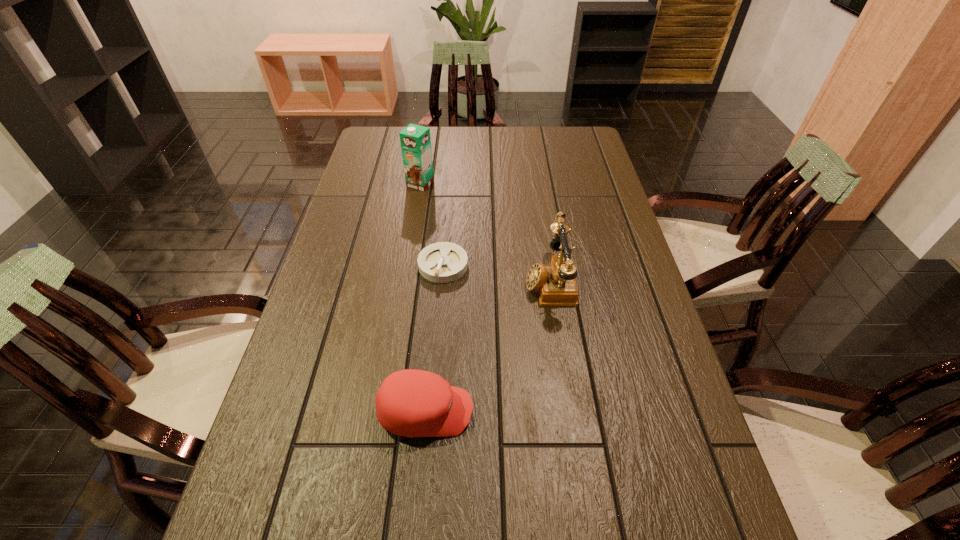
Where is `free spot between the telephone and the ashtray`? The height and width of the screenshot is (540, 960). free spot between the telephone and the ashtray is located at coordinates (496, 273).

Locate an element on the screen. free space between the rightmost object and the second shortest object is located at coordinates (488, 346).

You are a GUI agent. You are given a task and a screenshot of the screen. Output one action in this format:
    pyautogui.click(x=<x>, y=<y>)
    Task: Click on the unoccupied area between the cap and the shortest object
    
    Given the screenshot: What is the action you would take?
    pyautogui.click(x=435, y=338)

Find the location of a particular element. The width and height of the screenshot is (960, 540). unoccupied area between the farthest object and the shortest object is located at coordinates (432, 225).

Locate an element on the screen. The image size is (960, 540). vacant space that is in between the second shortest object and the ashtray is located at coordinates (435, 338).

Image resolution: width=960 pixels, height=540 pixels. I want to click on vacant space in between the third shortest object and the shortest object, so click(x=496, y=273).

Where is `the third closest object to the cap`? Image resolution: width=960 pixels, height=540 pixels. the third closest object to the cap is located at coordinates (415, 140).

Where is `object that is the third closest to the shortest object`? This screenshot has width=960, height=540. object that is the third closest to the shortest object is located at coordinates (412, 403).

The width and height of the screenshot is (960, 540). What are the coordinates of `vacant area that satisfies the following two spatial constraints: 1. on the front side of the ashtray; 2. on the front-facing side of the second shortest object` in the screenshot? It's located at (431, 411).

Identify the location of vacant space that satisfies the following two spatial constraints: 1. on the front side of the farthest object; 2. on the right side of the ashtray. The height and width of the screenshot is (540, 960). (407, 265).